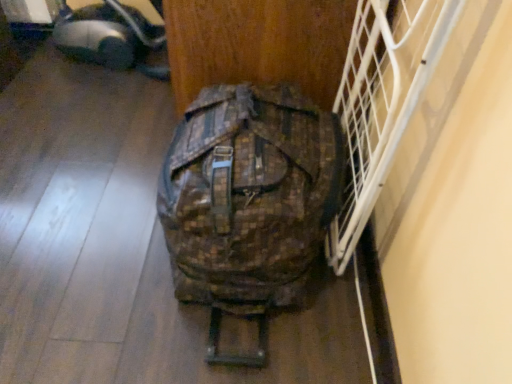
I want to click on free space to the left of camouflage fabric backpack at center, so point(85,237).